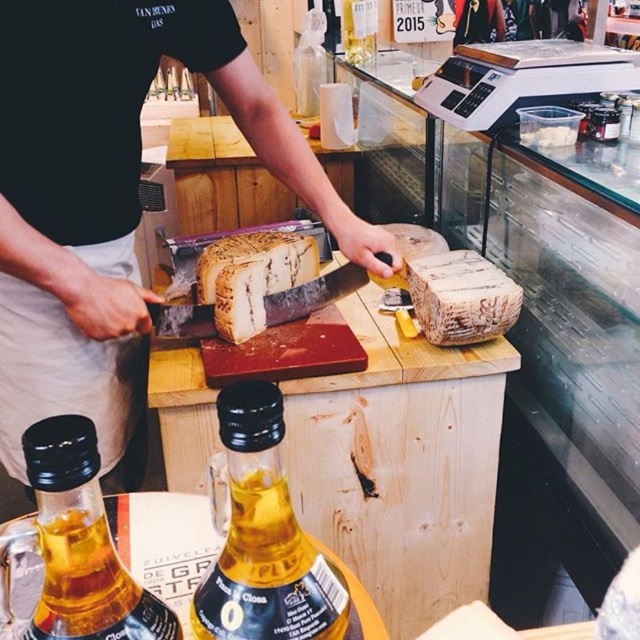
Question: Can you confirm if translucent glass bottle at center is bigger than translucent glass bottle at lower left?

Choices:
 (A) yes
 (B) no

Answer: (B)

Question: Where is translucent glass bottle at center located in relation to white crumbly cheese at center in the image?

Choices:
 (A) above
 (B) below

Answer: (B)

Question: Which point appears farthest from the camera in this image?

Choices:
 (A) (216, 307)
 (B) (58, 451)
 (C) (86, 8)

Answer: (A)

Question: Among these objects, which one is nearest to the camera?

Choices:
 (A) black matte bread at center
 (B) translucent glass bottle at center
 (C) white crumbly bread at center
 (D) translucent glass bottle at lower left

Answer: (D)

Question: Is translucent glass bottle at lower left bigger than white crumbly cheese at center?

Choices:
 (A) yes
 (B) no

Answer: (A)

Question: Which of the following is the farthest from the observer?

Choices:
 (A) tap(204, 282)
 (B) tap(38, 348)
 (C) tap(52, 424)

Answer: (A)